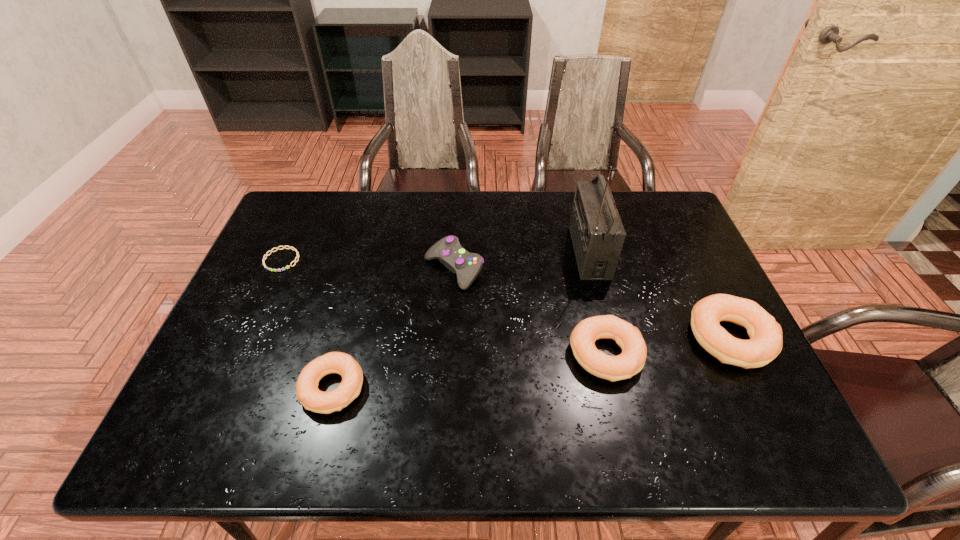
The width and height of the screenshot is (960, 540). Identify the location of free space between the shortest object and the shortest bagel. (307, 324).

The image size is (960, 540). In order to click on free space between the second shortest bagel and the rightmost bagel in this screenshot , I will do `click(668, 346)`.

This screenshot has height=540, width=960. Identify the location of object that can be found as the third closest to the radio receiver. (448, 251).

Locate which object ranks second in proximity to the second tallest bagel. Please provide its 2D coordinates. Your answer should be formatted as a tuple, i.e. [(x, y)], where the tuple contains the x and y coordinates of a point satisfying the conditions above.

[(597, 232)]

Identify which bagel is the second closest to the second bagel from right to left. Please provide its 2D coordinates. Your answer should be formatted as a tuple, i.e. [(x, y)], where the tuple contains the x and y coordinates of a point satisfying the conditions above.

[(307, 392)]

The height and width of the screenshot is (540, 960). Identify the location of the second closest bagel to the tallest object. (765, 343).

Locate an element on the screen. The height and width of the screenshot is (540, 960). vacant space that satisfies the following two spatial constraints: 1. on the front panel of the radio receiver; 2. on the surface of the shortest object showing star-shaped elements is located at coordinates (590, 260).

The image size is (960, 540). Identify the location of vacant region that satisfies the following two spatial constraints: 1. on the surface of the bracelet showing star-shaped elements; 2. on the left side of the control. (277, 269).

This screenshot has height=540, width=960. Identify the location of vacant point that satisfies the following two spatial constraints: 1. on the surface of the second bagel from right to left showing star-shaped elements; 2. on the left side of the shortest object. (239, 354).

Identify the location of free space that satisfies the following two spatial constraints: 1. on the surface of the leftmost object showing star-shaped elements; 2. on the left side of the third object from left to right. (277, 269).